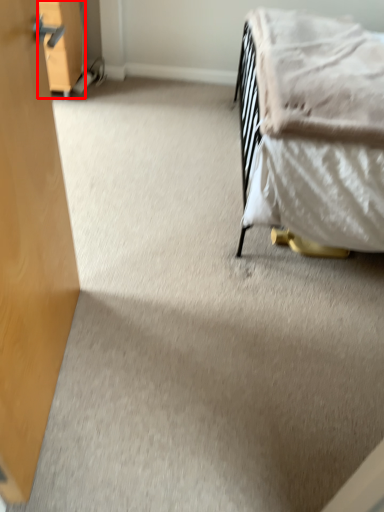
Question: Considering the relative positions of drawer (annotated by the red box) and blanket in the image provided, where is drawer (annotated by the red box) located with respect to the staircase?

Choices:
 (A) left
 (B) right

Answer: (A)